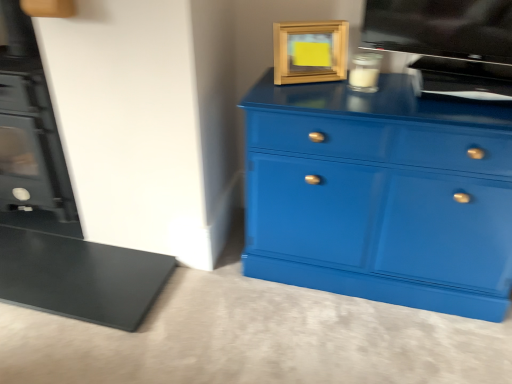
Question: Is glossy blue chest of drawers at center bigger or smaller than wooden picture frame at upper center?

Choices:
 (A) big
 (B) small

Answer: (A)

Question: Does point (284, 109) appear closer or farther from the camera than point (278, 28)?

Choices:
 (A) closer
 (B) farther

Answer: (A)

Question: Estimate the real-world distances between objects in this image. Which object is closer to the wooden picture frame at upper center?

Choices:
 (A) clear glass candle at upper center, placed as the first appliance when sorted from left to right
 (B) glossy blue chest of drawers at center
 (C) flat screen tv at upper right, placed as the 2th appliance when sorted from left to right
 (D) black matte fireplace at left

Answer: (A)

Question: Based on their relative distances, which object is farther from the black matte fireplace at left?

Choices:
 (A) glossy blue chest of drawers at center
 (B) wooden picture frame at upper center
 (C) clear glass candle at upper center, which appears as the second appliance when viewed from the right
 (D) flat screen tv at upper right, the 1th appliance when ordered from right to left

Answer: (D)